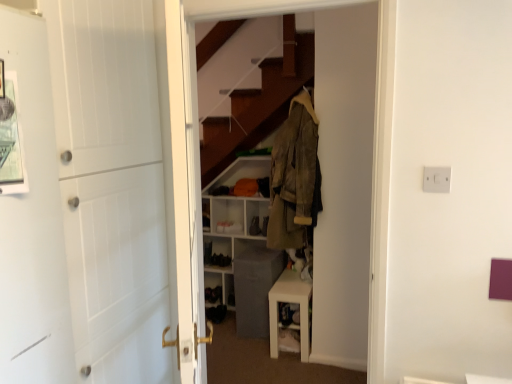
Question: Looking at the image, does brown fabric coat at center seem bigger or smaller compared to metallic silver picture frame at upper left?

Choices:
 (A) big
 (B) small

Answer: (A)

Question: Does point (317, 43) appear closer or farther from the camera than point (3, 127)?

Choices:
 (A) closer
 (B) farther

Answer: (B)

Question: Estimate the real-world distances between objects in this image. Which object is closer to the brown fabric coat at center?

Choices:
 (A) black leather shoe at lower center, which is counted as the first shoe, starting from the left
 (B) white matte table at lower center
 (C) matte black shoe at center, which is the 1th shoe in top-to-bottom order
 (D) leather-like brown coat at center
 (E) white matte door at left

Answer: (D)

Question: Estimate the real-world distances between objects in this image. Which object is closer to the black fabric shoe at lower center, the third shoe positioned from the top?

Choices:
 (A) white matte door at left
 (B) brown fabric coat at center
 (C) matte black shoe at center, the first shoe from the right
 (D) black leather shoe at lower center, arranged as the 2th shoe when viewed from the top
 (E) white matte table at lower center

Answer: (D)